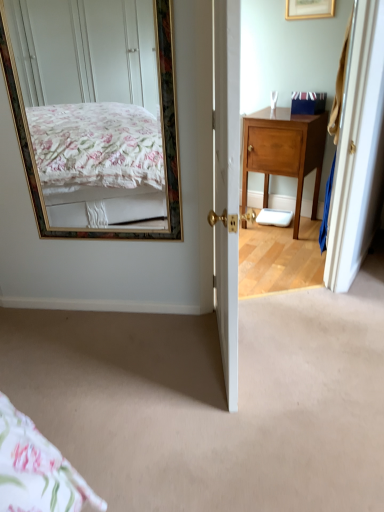
Question: Should I look upward or downward to see blue cardboard box at upper right?

Choices:
 (A) up
 (B) down

Answer: (A)

Question: Is wooden cabinet at right positioned beyond the bounds of blue cardboard box at upper right?

Choices:
 (A) yes
 (B) no

Answer: (A)

Question: Considering the relative sizes of wooden cabinet at right and blue cardboard box at upper right in the image provided, is wooden cabinet at right taller than blue cardboard box at upper right?

Choices:
 (A) no
 (B) yes

Answer: (B)

Question: Is wooden cabinet at right oriented towards blue cardboard box at upper right?

Choices:
 (A) no
 (B) yes

Answer: (A)

Question: Is wooden cabinet at right at the left side of blue cardboard box at upper right?

Choices:
 (A) no
 (B) yes

Answer: (B)

Question: From the image's perspective, is wooden cabinet at right located beneath blue cardboard box at upper right?

Choices:
 (A) no
 (B) yes

Answer: (B)

Question: Is wooden cabinet at right placed right next to blue cardboard box at upper right?

Choices:
 (A) no
 (B) yes

Answer: (A)

Question: Is carpet at center oriented away from gold-framed mirror at upper left?

Choices:
 (A) yes
 (B) no

Answer: (B)

Question: From the image's perspective, is carpet at center above gold-framed mirror at upper left?

Choices:
 (A) yes
 (B) no

Answer: (B)

Question: Is the position of carpet at center less distant than that of gold-framed mirror at upper left?

Choices:
 (A) yes
 (B) no

Answer: (A)

Question: Considering the relative sizes of carpet at center and gold-framed mirror at upper left in the image provided, is carpet at center bigger than gold-framed mirror at upper left?

Choices:
 (A) yes
 (B) no

Answer: (A)

Question: Does carpet at center have a lesser width compared to gold-framed mirror at upper left?

Choices:
 (A) no
 (B) yes

Answer: (A)

Question: Can you confirm if carpet at center is smaller than gold-framed mirror at upper left?

Choices:
 (A) no
 (B) yes

Answer: (A)

Question: Is wooden cabinet at right positioned with its back to carpet at center?

Choices:
 (A) yes
 (B) no

Answer: (B)